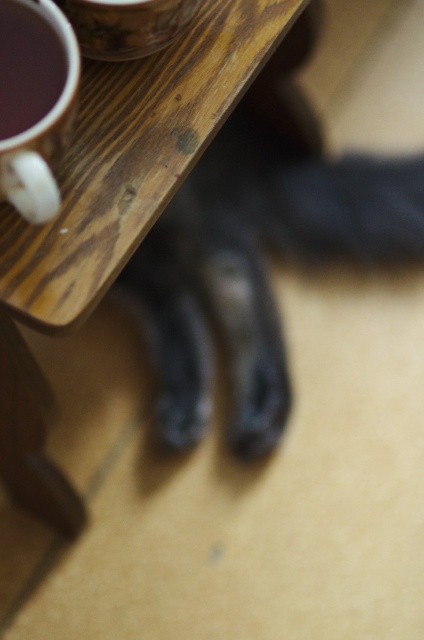
Question: Among these objects, which one is farthest from the camera?

Choices:
 (A) matte ceramic cup at upper left
 (B) wooden table at upper center

Answer: (B)

Question: Can you confirm if wooden table at upper center is wider than matte ceramic cup at upper left?

Choices:
 (A) yes
 (B) no

Answer: (A)

Question: Which of the following is the closest to the observer?

Choices:
 (A) (31, 108)
 (B) (301, 141)

Answer: (A)

Question: Is wooden table at upper center closer to camera compared to matte ceramic cup at upper left?

Choices:
 (A) yes
 (B) no

Answer: (B)

Question: Is wooden table at upper center below matte ceramic cup at upper left?

Choices:
 (A) yes
 (B) no

Answer: (A)